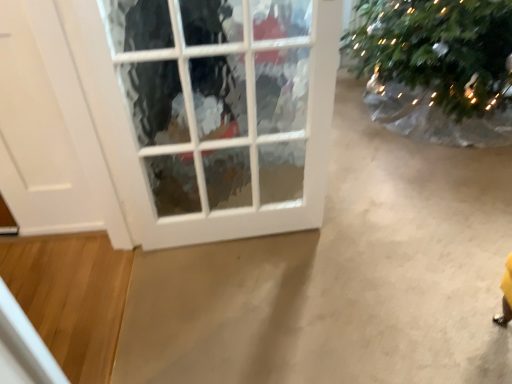
The image size is (512, 384). I want to click on free space underneath white glass window at center (from a real-world perspective), so click(x=228, y=247).